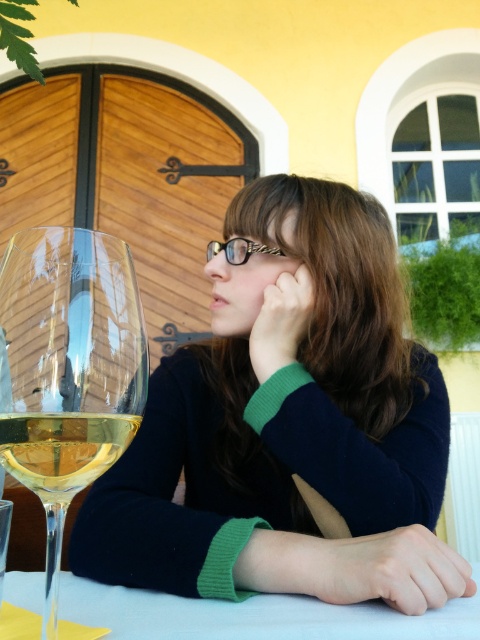
Question: Where is white glossy table at lower center located in relation to gold chain-link glasses at center in the image?

Choices:
 (A) above
 (B) below

Answer: (B)

Question: Is transparent glass wine glass at lower left wider than translucent glass wine at lower left?

Choices:
 (A) yes
 (B) no

Answer: (A)

Question: Estimate the real-world distances between objects in this image. Which object is closer to the white glossy table at lower center?

Choices:
 (A) gold chain-link glasses at center
 (B) translucent glass wine at lower left
 (C) transparent glass wine glass at lower left
 (D) matte glass wine glass at left

Answer: (C)

Question: Among these objects, which one is nearest to the camera?

Choices:
 (A) matte glass wine glass at left
 (B) transparent glass wine glass at lower left

Answer: (B)

Question: Considering the real-world distances, which object is closest to the white glossy table at lower center?

Choices:
 (A) translucent glass wine at lower left
 (B) matte glass wine glass at left
 (C) gold chain-link glasses at center
 (D) transparent glass wine glass at lower left

Answer: (D)

Question: Does translucent glass wine at lower left appear on the left side of gold chain-link glasses at center?

Choices:
 (A) yes
 (B) no

Answer: (A)